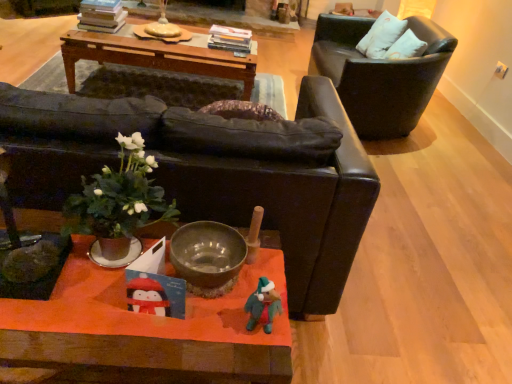
This screenshot has width=512, height=384. I want to click on vacant area that is situated to the right of matte black couch at center, the 1th chair when ordered from front to back, so click(x=414, y=267).